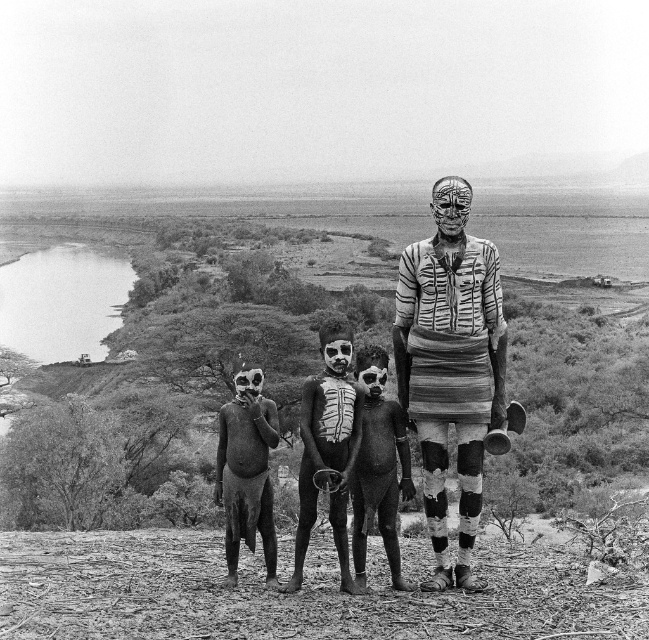
Question: Which object is closer to the camera taking this photo?

Choices:
 (A) painted wood figure at center
 (B) matte mud man at lower left
 (C) smooth skin child at center
 (D) black textured body paint at center

Answer: (A)

Question: Is matte mud man at lower left smaller than smooth skin child at center?

Choices:
 (A) yes
 (B) no

Answer: (B)

Question: Is painted wood figure at center to the right of matte mud man at lower left from the viewer's perspective?

Choices:
 (A) no
 (B) yes

Answer: (B)

Question: Which object is positioned closest to the painted wood figure at center?

Choices:
 (A) smooth skin child at center
 (B) black textured body paint at center

Answer: (A)

Question: Is black textured body paint at center wider than matte mud man at lower left?

Choices:
 (A) yes
 (B) no

Answer: (B)

Question: Among these objects, which one is nearest to the camera?

Choices:
 (A) smooth skin child at center
 (B) matte mud man at lower left
 (C) painted wood figure at center

Answer: (C)